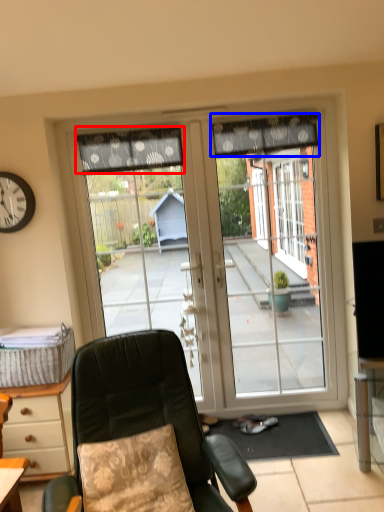
Question: Which of the following is the closest to the observer, curtain (highlighted by a red box) or curtain (highlighted by a blue box)?

Choices:
 (A) curtain
 (B) curtain

Answer: (B)